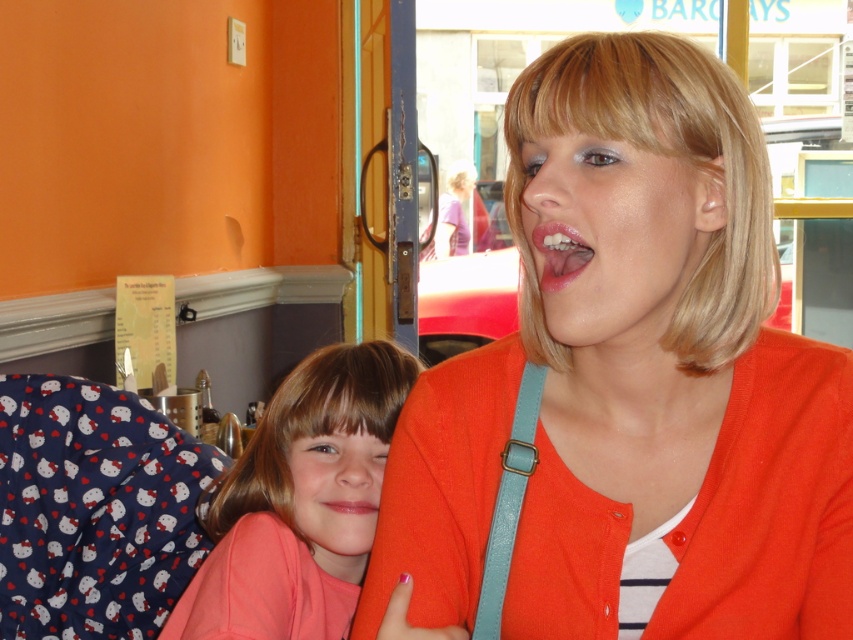
Question: Is matte orange face at center behind glossy pink lips at center?

Choices:
 (A) no
 (B) yes

Answer: (A)

Question: Is orange matte cardigan at center to the left of pink glossy lips at center from the viewer's perspective?

Choices:
 (A) no
 (B) yes

Answer: (A)

Question: Which point is farther to the camera?

Choices:
 (A) (334, 512)
 (B) (376, 452)
 (C) (253, 570)

Answer: (B)

Question: Which object appears closest to the camera in this image?

Choices:
 (A) smooth skin face at center
 (B) matte orange face at center
 (C) light blue leather strap at center

Answer: (B)

Question: Where is orange matte cardigan at center located in relation to pink glossy lips at center in the image?

Choices:
 (A) below
 (B) above

Answer: (B)

Question: Which of the following is the farthest from the observer?

Choices:
 (A) (347, 472)
 (B) (614, 285)
 (C) (698, 100)
 (D) (335, 499)

Answer: (A)